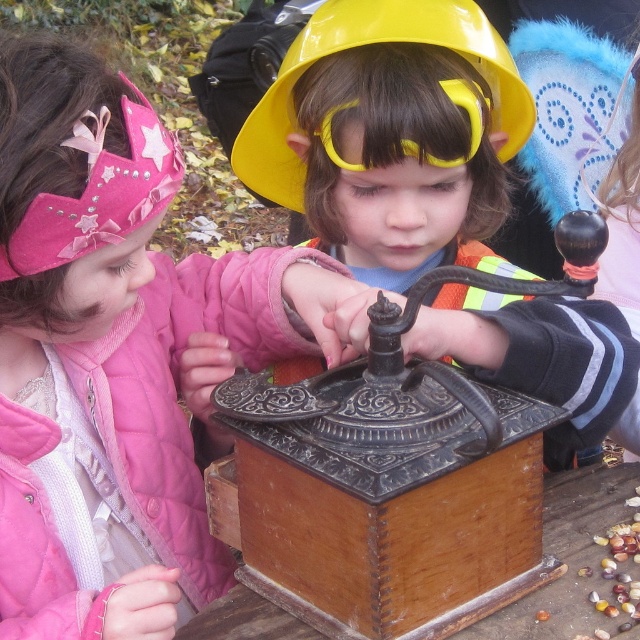
Is point (1, 346) in front of point (436, 596)?

No, (1, 346) is behind (436, 596).

Is pink quilted jacket at left to the left of wooden box at center from the viewer's perspective?

Correct, you'll find pink quilted jacket at left to the left of wooden box at center.

Locate an element on the screen. pink quilted jacket at left is located at coordinates (113, 355).

Image resolution: width=640 pixels, height=640 pixels. What are the coordinates of `wooden box at center` in the screenshot? It's located at (387, 492).

Which is behind, point (289, 445) or point (483, 92)?

Point (483, 92)

Where is `wooden box at center`? The width and height of the screenshot is (640, 640). wooden box at center is located at coordinates (387, 492).

From the picture: Is matte black grinder at center thinner than yellow hard hat at center?

No, matte black grinder at center is not thinner than yellow hard hat at center.

This screenshot has width=640, height=640. Identify the location of matte black grinder at center. (388, 129).